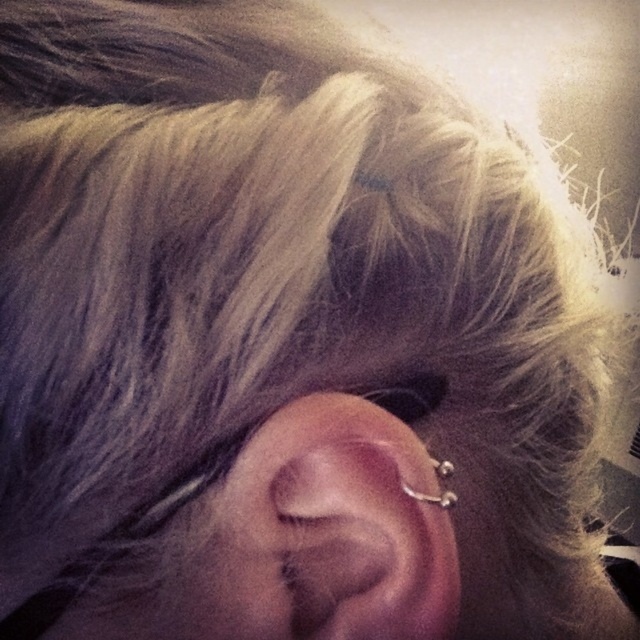
You are a photographer adjusting the lighting to highlight the details of the silver metallic ear at center and the silver metallic hoop at ear. Based on their positions, which one should you focus on first to ensure both are well lit?

The silver metallic ear at center is below the silver metallic hoop at ear, so you should focus on lighting the silver metallic hoop at ear first to ensure both are properly illuminated.

You are a jeweler examining an ear with two silver metallic pieces. The silver metallic ear at center and the silver metallic hoop at ear are both visible. Which one has a greater width?

The silver metallic ear at center has a greater width than the silver metallic hoop at ear according to the description.

From the picture: You are an artist trying to sketch this ear piercing. To ensure accuracy, you need to know the exact 2D coordinates of the silver metallic ear at center. What are the coordinates?

The silver metallic ear at center is located at coordinates (332, 531).